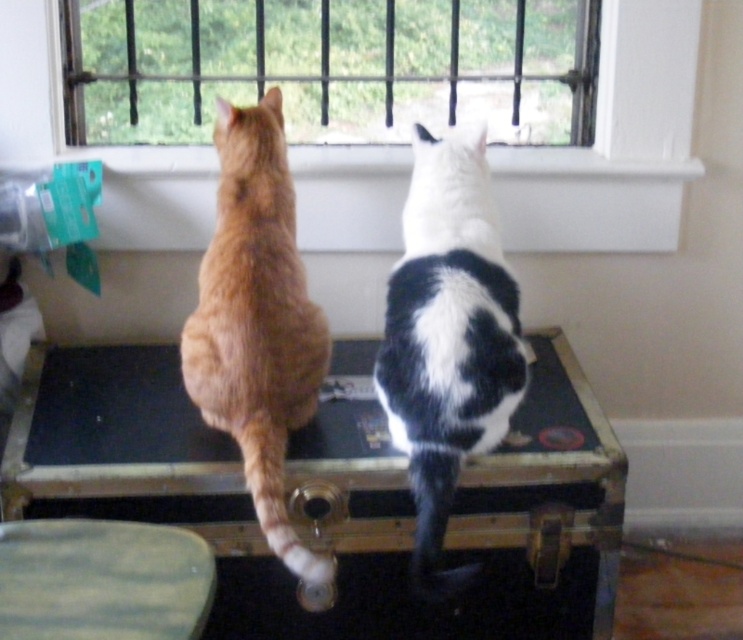
Question: Estimate the real-world distances between objects in this image. Which object is closer to the black-and-white fur cat at center?

Choices:
 (A) white smooth window sill at upper center
 (B) wooden stool at center

Answer: (B)

Question: Is the position of clear glass window at upper center more distant than that of black-and-white fur cat at center?

Choices:
 (A) no
 (B) yes

Answer: (B)

Question: Does white smooth window sill at upper center have a lesser width compared to black-and-white fur cat at center?

Choices:
 (A) no
 (B) yes

Answer: (A)

Question: Is white smooth window sill at upper center positioned before orange fur cat at center?

Choices:
 (A) no
 (B) yes

Answer: (A)

Question: Which point is farther from the camera taking this photo?

Choices:
 (A) (483, 100)
 (B) (224, 308)
 (C) (603, 193)

Answer: (A)

Question: Among these objects, which one is farthest from the camera?

Choices:
 (A) wooden stool at center
 (B) orange fur cat at center

Answer: (A)